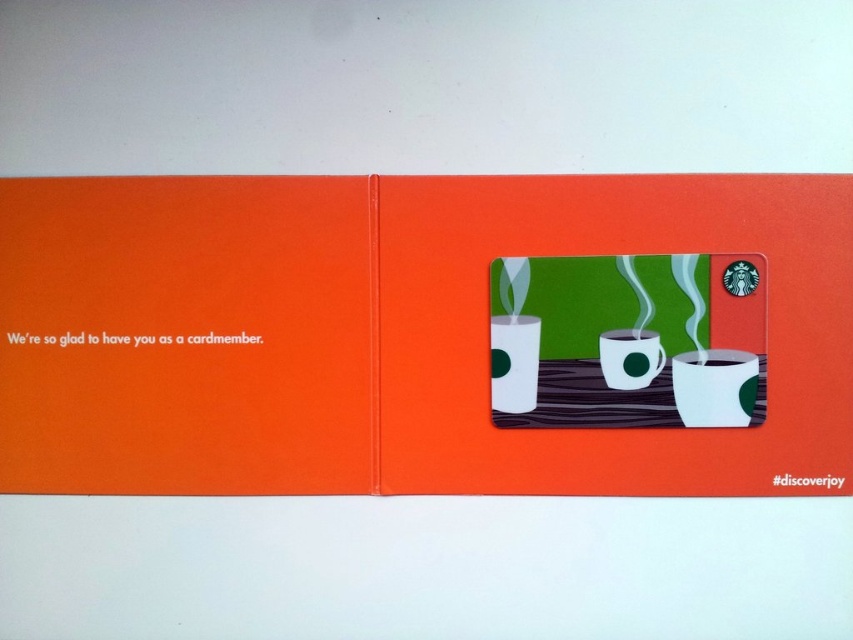
You are standing at a distance of 5 feet from the Starbucks promotional card. Can you reach the point at coordinates point (796, 225) on the card without moving closer?

The point at coordinates point (796, 225) is 4.87 feet away from the viewer. Since you are standing 5 feet away, you can reach it without moving closer.

You are designing a promotional card for Starbucks and want to ensure that the white glossy mug at upper right and the green matte cup at center are clearly visible. Given their sizes, which one might need to be adjusted to avoid being too small or too large?

The white glossy mug at upper right is larger in size than the green matte cup at center, so the green matte cup at center might need to be made larger to ensure it is not too small compared to the white glossy mug at upper right.